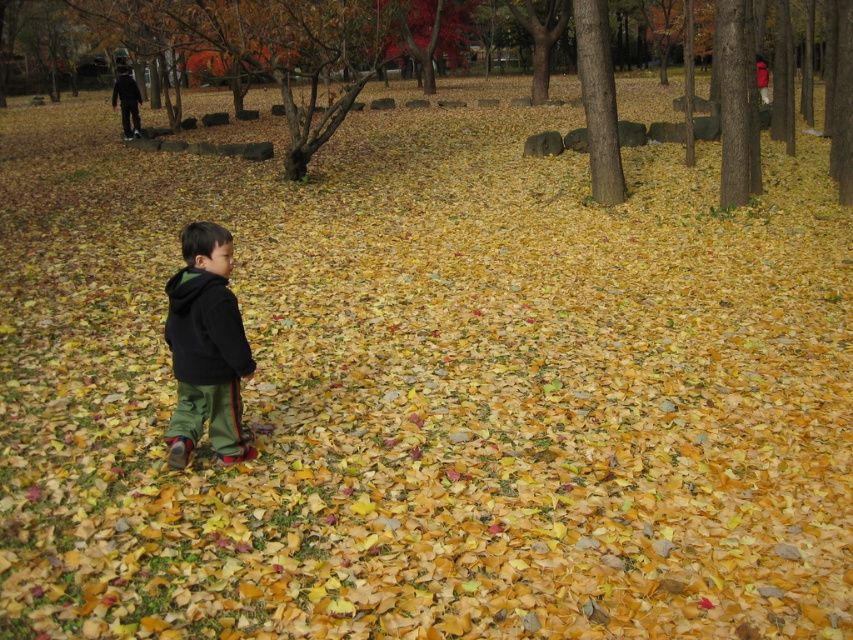
You are a hiker trying to identify two trees in the image. The scene shows a brown bark tree at center and a brown rough bark tree at center. Which tree is positioned higher up in the image?

The brown bark tree at center is positioned higher up in the image than the brown rough bark tree at center.

You are standing in the autumn park scene. You notice a brown bark tree at center and a black fleece jacket at center. How far apart are these two objects from each other?

The brown bark tree at center and the black fleece jacket at center are 10.97 meters apart from each other.

Consider the image. You are standing in the autumn park scene and want to determine which of the two points, point (x=209, y=291) or point (x=601, y=109), is nearer to you. Based on the scene description, which point is closer?

Point (x=209, y=291) is closer to the camera than point (x=601, y=109).